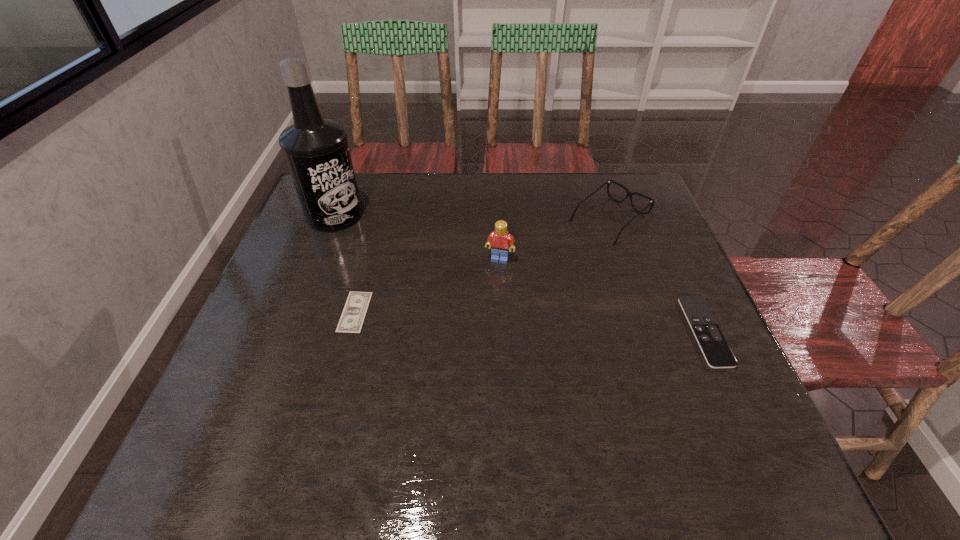
The height and width of the screenshot is (540, 960). What are the coordinates of `money` in the screenshot? It's located at (353, 315).

Find the location of a particular element. This screenshot has width=960, height=540. the shortest object is located at coordinates (353, 315).

Identify the location of the fourth tallest object. (714, 347).

Locate an element on the screen. the third shortest object is located at coordinates (629, 194).

This screenshot has width=960, height=540. Find the location of `the tallest object`. the tallest object is located at coordinates (316, 150).

Identify the location of liquor. The image size is (960, 540). (316, 150).

Where is `the third object from left to right`? The image size is (960, 540). the third object from left to right is located at coordinates [x=499, y=240].

Locate an element on the screen. This screenshot has height=540, width=960. Lego is located at coordinates (499, 240).

What are the coordinates of `free region located on the left of the fourth object from right to left` in the screenshot? It's located at (293, 312).

Locate an element on the screen. blank space located 0.260m on the back of the remote control is located at coordinates (659, 228).